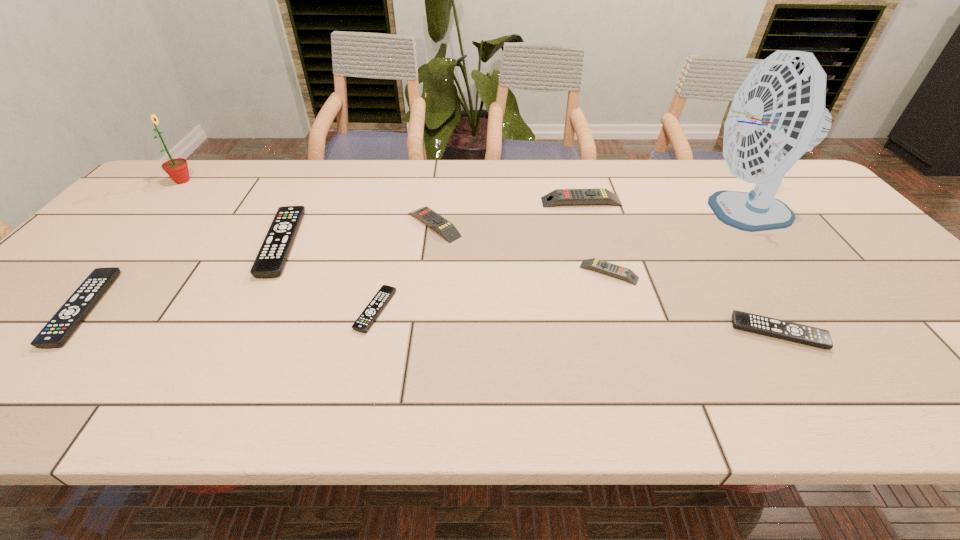
The width and height of the screenshot is (960, 540). I want to click on free space in the image that satisfies the following two spatial constraints: 1. on the back side of the nearest yellow remote control; 2. on the face of the green sunflower, so click(x=580, y=181).

In order to click on free space that satisfies the following two spatial constraints: 1. on the face of the green sunflower; 2. on the left side of the second farthest yellow remote control in this screenshot , I will do `click(141, 225)`.

Locate an element on the screen. Image resolution: width=960 pixels, height=540 pixels. vacant space that satisfies the following two spatial constraints: 1. on the face of the eighth shortest object; 2. on the right side of the nearest yellow remote control is located at coordinates (97, 273).